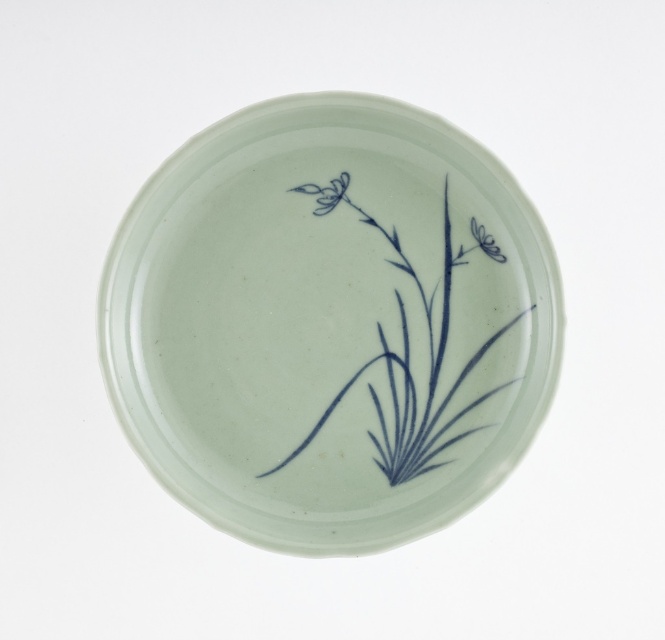
Which is more to the left, blue glossy flower at upper left or blue porcelain flower at center?

blue glossy flower at upper left

Measure the distance between blue glossy flower at upper left and camera.

blue glossy flower at upper left is 27.73 centimeters away from camera.

Where is `blue glossy flower at upper left`? Image resolution: width=665 pixels, height=640 pixels. blue glossy flower at upper left is located at coordinates (325, 193).

Can you confirm if lustre porcelain plate at center is positioned above blue ink plant at center?

Yes, lustre porcelain plate at center is above blue ink plant at center.

Who is higher up, lustre porcelain plate at center or blue ink plant at center?

Positioned higher is lustre porcelain plate at center.

The height and width of the screenshot is (640, 665). What do you see at coordinates (329, 324) in the screenshot?
I see `lustre porcelain plate at center` at bounding box center [329, 324].

Find the location of a particular element. The width and height of the screenshot is (665, 640). lustre porcelain plate at center is located at coordinates (329, 324).

Does blue ink plant at center have a lesser height compared to blue porcelain flower at center?

No.

Can you confirm if blue ink plant at center is taller than blue porcelain flower at center?

Yes, blue ink plant at center is taller than blue porcelain flower at center.

Between point (399, 305) and point (477, 244), which one is positioned in front?

Point (477, 244)

Locate an element on the screen. blue ink plant at center is located at coordinates (412, 372).